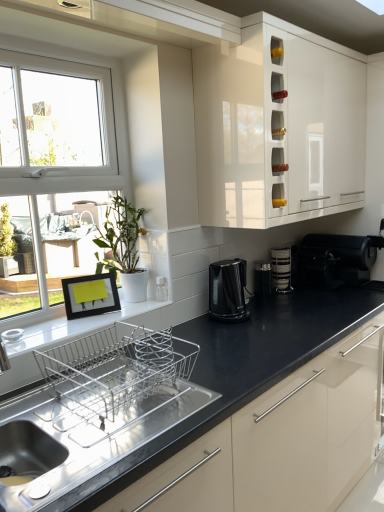
Question: Is white glossy cabinet at upper center looking in the opposite direction of black plastic toaster at right, which is the second appliance from back to front?

Choices:
 (A) no
 (B) yes

Answer: (A)

Question: From the image's perspective, is white glossy cabinet at upper center over black plastic toaster at right, acting as the 1th appliance starting from the right?

Choices:
 (A) no
 (B) yes

Answer: (B)

Question: Are white glossy cabinet at upper center and black plastic toaster at right, acting as the 1th appliance starting from the right, located far from each other?

Choices:
 (A) no
 (B) yes

Answer: (A)

Question: Does white glossy cabinet at upper center have a lesser width compared to black plastic toaster at right, the 2th appliance when ordered from front to back?

Choices:
 (A) yes
 (B) no

Answer: (A)

Question: Can you confirm if white glossy cabinet at upper center is smaller than black plastic toaster at right, arranged as the 3th appliance when viewed from the left?

Choices:
 (A) yes
 (B) no

Answer: (B)

Question: Considering the relative positions of matte white coffee maker at upper center, acting as the first appliance starting from the front, and white glossy cabinet at upper center in the image provided, is matte white coffee maker at upper center, acting as the first appliance starting from the front, to the left or to the right of white glossy cabinet at upper center?

Choices:
 (A) right
 (B) left

Answer: (B)

Question: From the image's perspective, is matte white coffee maker at upper center, which appears as the 3th appliance when viewed from the back, above or below white glossy cabinet at upper center?

Choices:
 (A) below
 (B) above

Answer: (A)

Question: Considering the positions of point (160, 291) and point (337, 66), is point (160, 291) closer or farther from the camera than point (337, 66)?

Choices:
 (A) farther
 (B) closer

Answer: (B)

Question: Relative to white glossy cabinet at upper center, is matte white coffee maker at upper center, acting as the first appliance starting from the front, in front or behind?

Choices:
 (A) behind
 (B) front

Answer: (A)

Question: Is white glossy window sill at lower left wider or thinner than white glossy cabinet at upper center?

Choices:
 (A) wide
 (B) thin

Answer: (B)

Question: Based on their sizes in the image, would you say white glossy window sill at lower left is bigger or smaller than white glossy cabinet at upper center?

Choices:
 (A) big
 (B) small

Answer: (B)

Question: Would you say white glossy window sill at lower left is inside or outside white glossy cabinet at upper center?

Choices:
 (A) outside
 (B) inside

Answer: (A)

Question: From their relative heights in the image, would you say white glossy window sill at lower left is taller or shorter than white glossy cabinet at upper center?

Choices:
 (A) short
 (B) tall

Answer: (A)

Question: Choose the correct answer: Is stacked plates at center inside black plastic toaster at center, the 2th appliance when ordered from right to left, or outside it?

Choices:
 (A) outside
 (B) inside

Answer: (A)

Question: In terms of height, does stacked plates at center look taller or shorter compared to black plastic toaster at center, the 2th appliance when ordered from right to left?

Choices:
 (A) tall
 (B) short

Answer: (A)